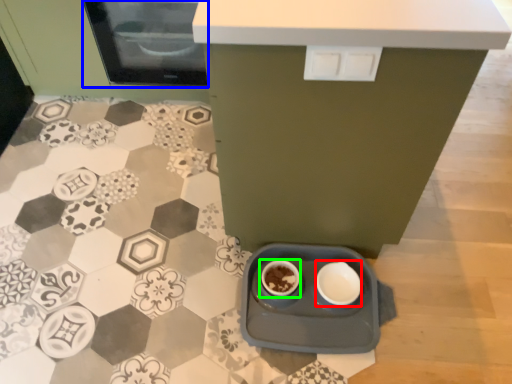
Question: Which object is the closest to the bowl (highlighted by a red box)? Choose among these: home appliance (highlighted by a blue box) or coffee cup (highlighted by a green box).

Choices:
 (A) home appliance
 (B) coffee cup

Answer: (B)